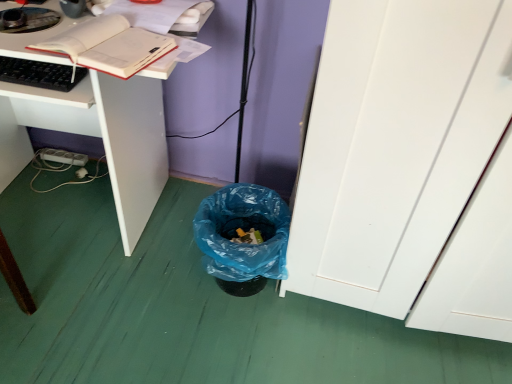
Question: Relative to blue plastic trash can at lower center, is black matte keyboard at left in front or behind?

Choices:
 (A) behind
 (B) front

Answer: (B)

Question: In terms of height, does black matte keyboard at left look taller or shorter compared to blue plastic trash can at lower center?

Choices:
 (A) tall
 (B) short

Answer: (B)

Question: Which of these objects is positioned closest to the white matte desk at lower left?

Choices:
 (A) blue plastic trash can at lower center
 (B) matte white book at upper left
 (C) black matte keyboard at left

Answer: (B)

Question: Which object is positioned closest to the blue plastic trash can at lower center?

Choices:
 (A) matte white book at upper left
 (B) black matte keyboard at left
 (C) white matte desk at lower left

Answer: (C)